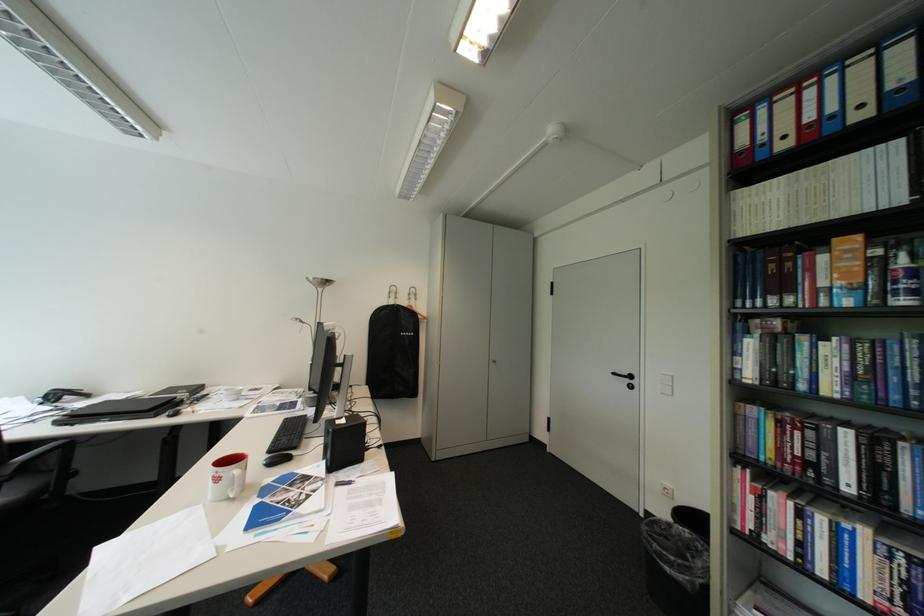
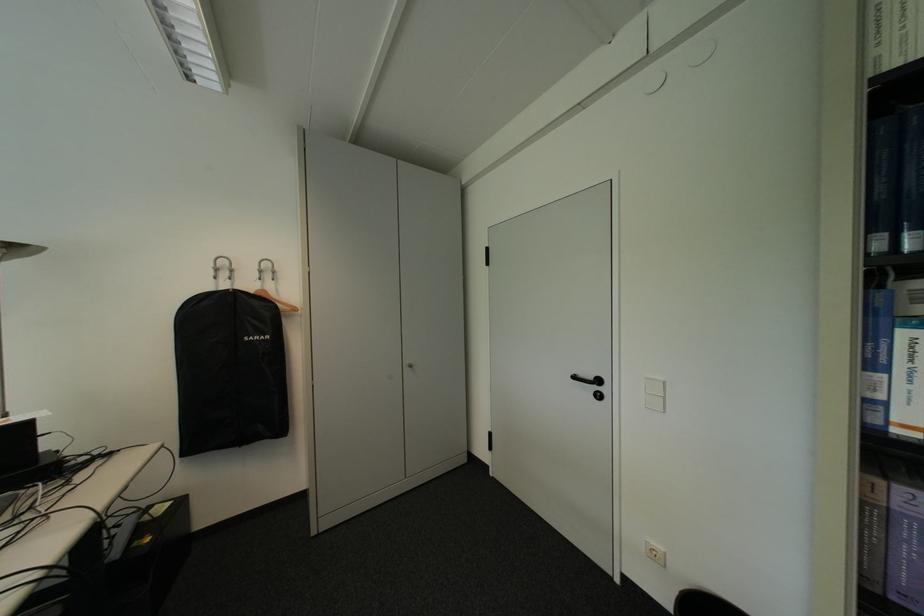
In a continuous first-person perspective shot, in which direction is the camera moving?

The cameraman walked toward right, forward.